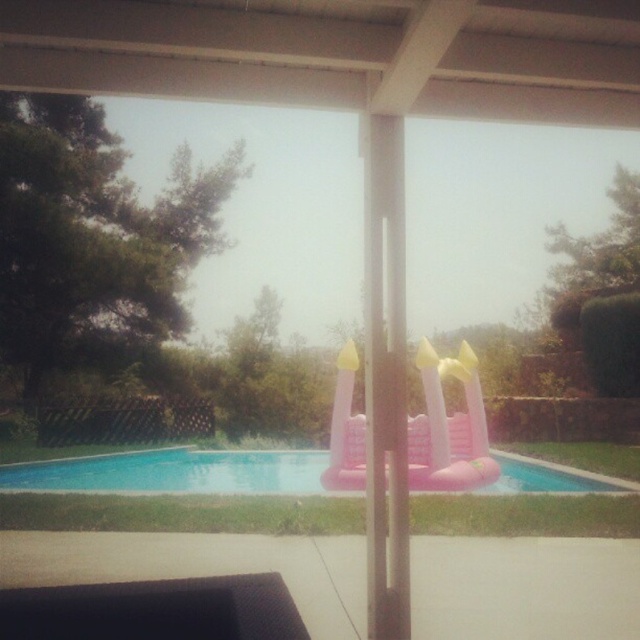
You are standing at the point with coordinates (173, 472) in the backyard scene. What object are you standing on?

You are standing on the pink inflatable castle at center.

You are standing on the patio and want to enter the pink inflatable castle at center. Which direction should you move to reach it first, considering there is also the pink inflatable slide at center in the way?

The pink inflatable castle at center is in front of the pink inflatable slide at center, so you should move forward towards the pink inflatable castle at center to reach it without needing to go around the slide.

You are standing in the backyard looking at the swimming pool and the inflatable castle. There are two points marked in the image. Which point is closer to you, point (516, 458) or point (436, 419)?

Point (516, 458) is further to the viewer than point (436, 419), so point (436, 419) is closer to you.